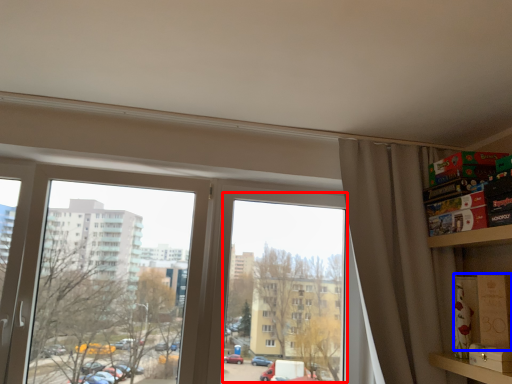
Question: Which object appears farthest to the camera in this image, window screen (highlighted by a red box) or cardboard box (highlighted by a blue box)?

Choices:
 (A) window screen
 (B) cardboard box

Answer: (A)